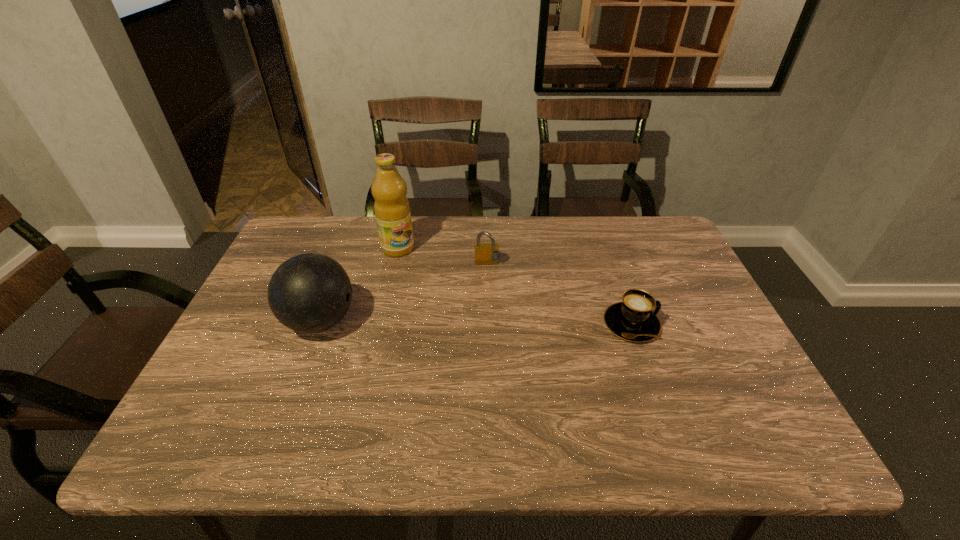
In order to click on bowling ball in this screenshot , I will do `click(309, 293)`.

Image resolution: width=960 pixels, height=540 pixels. I want to click on the leftmost object, so click(309, 293).

The image size is (960, 540). I want to click on the shortest object, so click(x=633, y=320).

At what (x,y) coordinates should I click in order to perform the action: click on the rightmost object. Please return your answer as a coordinate pair (x, y). The width and height of the screenshot is (960, 540). Looking at the image, I should click on (633, 320).

The height and width of the screenshot is (540, 960). Identify the location of the second farthest object. (485, 254).

At what (x,y) coordinates should I click in order to perform the action: click on the second shortest object. Please return your answer as a coordinate pair (x, y). The width and height of the screenshot is (960, 540). Looking at the image, I should click on (485, 254).

I want to click on the third object from right to left, so click(x=391, y=207).

Locate an element on the screen. The height and width of the screenshot is (540, 960). the tallest object is located at coordinates (391, 207).

Locate an element on the screen. Image resolution: width=960 pixels, height=540 pixels. vacant region located 0.350m on the grip area of the bowling ball is located at coordinates (495, 321).

At what (x,y) coordinates should I click in order to perform the action: click on free space located on the back of the shortest object. Please return your answer as a coordinate pair (x, y). The image size is (960, 540). Looking at the image, I should click on (613, 273).